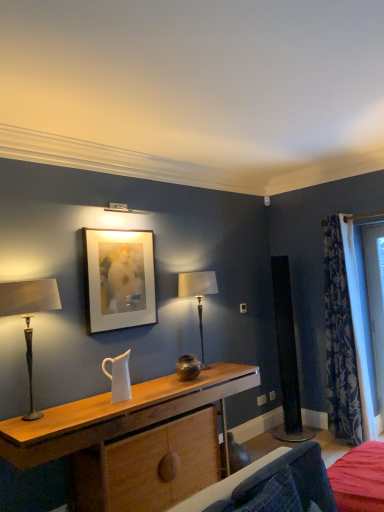
You are a GUI agent. You are given a task and a screenshot of the screen. Output one action in this format:
    pyautogui.click(x=<x>, y=<y>)
    Task: Click on the velvet blue armchair at lower right
    
    Given the screenshot: What is the action you would take?
    pyautogui.click(x=293, y=480)

Consider the image. Measure the distance between matte bronze table lamp at left, which is the 2th table lamp from right to left, and camera.

matte bronze table lamp at left, which is the 2th table lamp from right to left, and camera are 2.59 meters apart from each other.

Where is `blue floral fabric curtain at right`? The height and width of the screenshot is (512, 384). blue floral fabric curtain at right is located at coordinates (340, 341).

In order to face matte bronze table lamp at center, marked as the 1th table lamp in a back-to-front arrangement, should I rotate leftwards or rightwards?

You should look right and rotate roughly 1.345 degrees.

What do you see at coordinates (198, 295) in the screenshot? The width and height of the screenshot is (384, 512). I see `matte bronze table lamp at center, which ranks as the second table lamp in left-to-right order` at bounding box center [198, 295].

This screenshot has height=512, width=384. In order to click on velvet blue armchair at lower right in this screenshot , I will do `click(293, 480)`.

Is matte bronze table lamp at center, the 1th table lamp positioned from the right, positioned beyond the bounds of velvet blue armchair at lower right?

matte bronze table lamp at center, the 1th table lamp positioned from the right, lies outside velvet blue armchair at lower right's area.

Does point (198, 307) lie behind point (306, 501)?

Yes, point (198, 307) is farther from viewer.

Which object is thinner, matte bronze table lamp at center, which ranks as the 2th table lamp in front-to-back order, or velvet blue armchair at lower right?

matte bronze table lamp at center, which ranks as the 2th table lamp in front-to-back order.

Considering the sizes of objects wooden desk at center and matte white picture frame at upper center in the image provided, who is smaller, wooden desk at center or matte white picture frame at upper center?

matte white picture frame at upper center is smaller.

What's the angular difference between wooden desk at center and matte white picture frame at upper center's facing directions?

The angle between the facing direction of wooden desk at center and the facing direction of matte white picture frame at upper center is 0.781 degrees.

Is wooden desk at center next to matte white picture frame at upper center and touching it?

wooden desk at center and matte white picture frame at upper center are clearly separated.

Can you tell me how much velvet blue armchair at lower right and wooden desk at center differ in facing direction?

0.645 degrees.

From the image's perspective, between velvet blue armchair at lower right and wooden desk at center, who is located below?

wooden desk at center is shown below in the image.

Which object is closer to the camera, velvet blue armchair at lower right or wooden desk at center?

Positioned in front is velvet blue armchair at lower right.

Is matte bronze table lamp at left, which is counted as the second table lamp, starting from the back, next to wooden desk at center?

No, matte bronze table lamp at left, which is counted as the second table lamp, starting from the back, is not beside wooden desk at center.

Does matte bronze table lamp at left, which is counted as the second table lamp, starting from the back, turn towards wooden desk at center?

No, matte bronze table lamp at left, which is counted as the second table lamp, starting from the back, is not aimed at wooden desk at center.

This screenshot has width=384, height=512. There is a wooden desk at center. Identify the location of the 1st table lamp above it (from the image's perspective). (29, 316).

Who is smaller, matte bronze table lamp at left, which is the 2th table lamp from right to left, or wooden desk at center?

matte bronze table lamp at left, which is the 2th table lamp from right to left.

Is matte bronze table lamp at center, which ranks as the second table lamp in left-to-right order, at the back of matte bronze table lamp at left, arranged as the first table lamp when viewed from the front?

No, matte bronze table lamp at left, arranged as the first table lamp when viewed from the front, is not facing the opposite direction of matte bronze table lamp at center, which ranks as the second table lamp in left-to-right order.

From a real-world perspective, is matte bronze table lamp at left, arranged as the first table lamp when viewed from the front, positioned above or below matte bronze table lamp at center, marked as the 1th table lamp in a back-to-front arrangement?

In terms of real-world spatial position, matte bronze table lamp at left, arranged as the first table lamp when viewed from the front, is above matte bronze table lamp at center, marked as the 1th table lamp in a back-to-front arrangement.

Is matte bronze table lamp at left, the first table lamp positioned from the left, far away from matte bronze table lamp at center, marked as the 1th table lamp in a back-to-front arrangement?

Yes, matte bronze table lamp at left, the first table lamp positioned from the left, and matte bronze table lamp at center, marked as the 1th table lamp in a back-to-front arrangement, are quite far apart.

From the image's perspective, is matte bronze table lamp at left, which is counted as the second table lamp, starting from the back, positioned above or below matte bronze table lamp at center, the 1th table lamp positioned from the right?

From the image's perspective, matte bronze table lamp at left, which is counted as the second table lamp, starting from the back, appears below matte bronze table lamp at center, the 1th table lamp positioned from the right.

Who is smaller, blue floral fabric curtain at right or matte white picture frame at upper center?

Smaller between the two is matte white picture frame at upper center.

Are blue floral fabric curtain at right and matte white picture frame at upper center located far from each other?

Yes, blue floral fabric curtain at right and matte white picture frame at upper center are quite far apart.

From a real-world perspective, between blue floral fabric curtain at right and matte white picture frame at upper center, who is vertically lower?

From a 3D spatial view, blue floral fabric curtain at right is below.

From the image's perspective, who appears lower, blue floral fabric curtain at right or matte white picture frame at upper center?

From the image's view, blue floral fabric curtain at right is below.

Is point (303, 460) closer to camera compared to point (110, 241)?

Yes, point (303, 460) is in front of point (110, 241).

Is the surface of velvet blue armchair at lower right in direct contact with matte white picture frame at upper center?

No, velvet blue armchair at lower right is not making contact with matte white picture frame at upper center.

From the image's perspective, is velvet blue armchair at lower right under matte white picture frame at upper center?

Correct, velvet blue armchair at lower right appears lower than matte white picture frame at upper center in the image.

Is velvet blue armchair at lower right looking in the opposite direction of matte white picture frame at upper center?

No, velvet blue armchair at lower right is not facing the opposite direction of matte white picture frame at upper center.

From a real-world perspective, starting from the velvet blue armchair at lower right, which table lamp is the 1st one vertically above it? Please provide its 2D coordinates.

[(198, 295)]

Locate an element on the screen. The width and height of the screenshot is (384, 512). desk beneath the matte white picture frame at upper center (from a real-world perspective) is located at coordinates (115, 413).

From the image, which object appears to be nearer to velvet blue armchair at lower right, wooden desk at center or matte bronze table lamp at left, which is the 2th table lamp from right to left?

wooden desk at center.

Estimate the real-world distances between objects in this image. Which object is closer to matte white picture frame at upper center, wooden desk at center or velvet blue armchair at lower right?

The object closer to matte white picture frame at upper center is wooden desk at center.

When comparing their distances from blue floral fabric curtain at right, does matte bronze table lamp at center, which ranks as the 2th table lamp in front-to-back order, or wooden desk at center seem closer?

matte bronze table lamp at center, which ranks as the 2th table lamp in front-to-back order.

Looking at the image, which one is located closer to matte white picture frame at upper center, velvet blue armchair at lower right or wooden desk at center?

wooden desk at center is closer to matte white picture frame at upper center.

Which object lies further to the anchor point matte bronze table lamp at left, arranged as the first table lamp when viewed from the front, wooden desk at center or blue floral fabric curtain at right?

blue floral fabric curtain at right lies further to matte bronze table lamp at left, arranged as the first table lamp when viewed from the front, than the other object.

Considering their positions, is velvet blue armchair at lower right positioned closer to matte bronze table lamp at center, marked as the 1th table lamp in a back-to-front arrangement, than matte white picture frame at upper center?

Based on the image, matte white picture frame at upper center appears to be nearer to matte bronze table lamp at center, marked as the 1th table lamp in a back-to-front arrangement.

Looking at the image, which one is located further to blue floral fabric curtain at right, matte white picture frame at upper center or matte bronze table lamp at center, which ranks as the second table lamp in left-to-right order?

matte white picture frame at upper center lies further to blue floral fabric curtain at right than the other object.

When comparing their distances from matte white picture frame at upper center, does wooden desk at center or matte bronze table lamp at center, which ranks as the second table lamp in left-to-right order, seem further?

wooden desk at center lies further to matte white picture frame at upper center than the other object.

Where is `desk located between velvet blue armchair at lower right and matte bronze table lamp at center, the 1th table lamp positioned from the right, in the depth direction`? desk located between velvet blue armchair at lower right and matte bronze table lamp at center, the 1th table lamp positioned from the right, in the depth direction is located at coordinates (115, 413).

Locate an element on the screen. The height and width of the screenshot is (512, 384). picture frame situated between matte bronze table lamp at left, arranged as the first table lamp when viewed from the front, and blue floral fabric curtain at right from left to right is located at coordinates (118, 279).

Find the location of a particular element. This screenshot has width=384, height=512. desk located between velvet blue armchair at lower right and blue floral fabric curtain at right in the depth direction is located at coordinates (115, 413).

At what (x,y) coordinates should I click in order to perform the action: click on picture frame positioned between velvet blue armchair at lower right and matte bronze table lamp at center, marked as the 1th table lamp in a back-to-front arrangement, from near to far. Please return your answer as a coordinate pair (x, y). The height and width of the screenshot is (512, 384). Looking at the image, I should click on (118, 279).